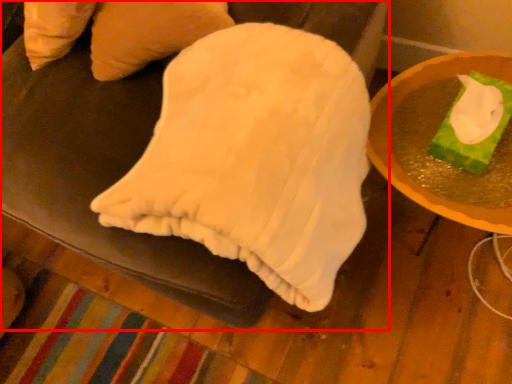
Question: From the image's perspective, where is furniture (annotated by the red box) located in relation to table in the image?

Choices:
 (A) above
 (B) below

Answer: (A)